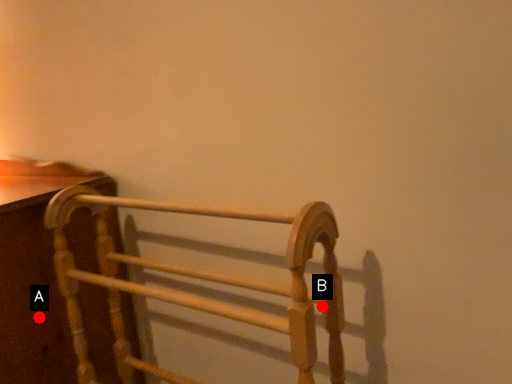
Question: Two points are circled on the image, labeled by A and B beside each circle. Which point is closer to the camera taking this photo?

Choices:
 (A) A is closer
 (B) B is closer

Answer: (B)